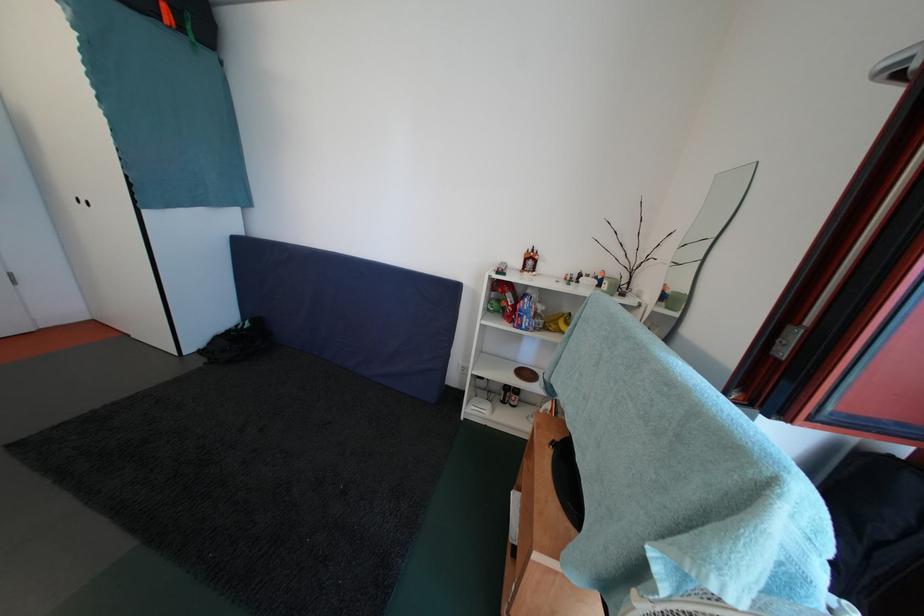
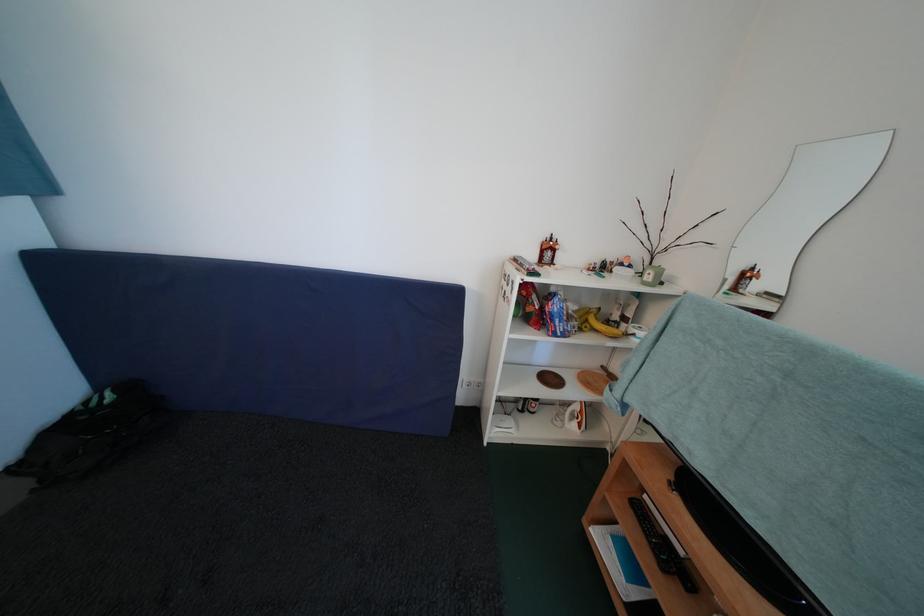
Question: The camera is either moving clockwise (left) or counter-clockwise (right) around the object. The first image is from the beginning of the video and the second image is from the end. Is the camera moving left or right when shooting the video?

Choices:
 (A) Left
 (B) Right

Answer: (A)